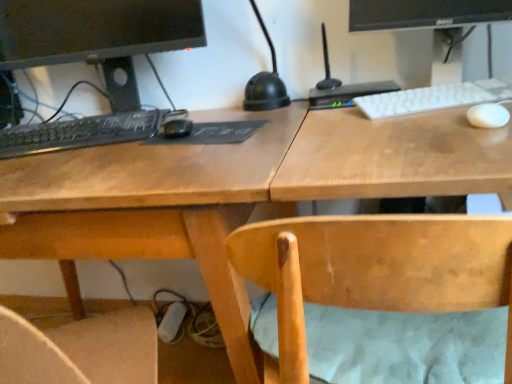
Question: Looking at the image, does black matte keyboard at left, which is the 2th computer in right-to-left order, seem bigger or smaller compared to white matte keyboard at upper right, the 1th computer keyboard in the right-to-left sequence?

Choices:
 (A) small
 (B) big

Answer: (B)

Question: Is black matte keyboard at left, which appears as the 1th computer when viewed from the left, taller or shorter than white matte keyboard at upper right, the second computer keyboard in the left-to-right sequence?

Choices:
 (A) tall
 (B) short

Answer: (A)

Question: Estimate the real-world distances between objects in this image. Which object is farther from the black matte keyboard at left, positioned as the first computer keyboard in left-to-right order?

Choices:
 (A) light brown wood chair at center
 (B) white matte keyboard at upper right, the second computer keyboard in the left-to-right sequence
 (C) black glossy monitor at upper right
 (D) white matte mouse at upper right
 (E) black plastic router at upper right, positioned as the second computer in left-to-right order

Answer: (D)

Question: Which object is the closest to the black plastic router at upper right, positioned as the second computer in left-to-right order?

Choices:
 (A) light brown wood chair at center
 (B) black glossy monitor at upper right
 (C) white matte mouse at upper right
 (D) white matte keyboard at upper right, the second computer keyboard in the left-to-right sequence
 (E) black matte keyboard at left, which appears as the 1th computer when viewed from the left

Answer: (D)